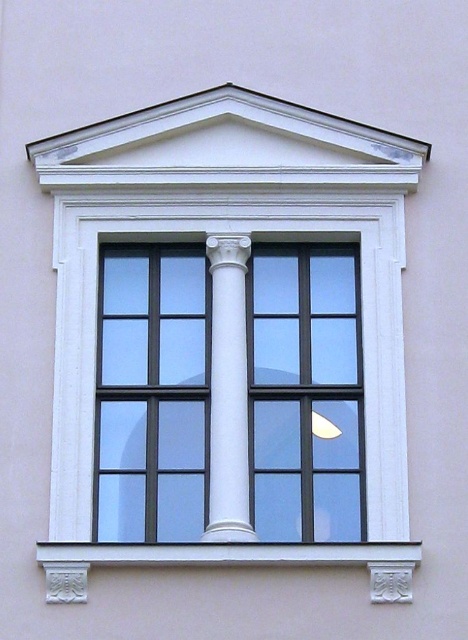
You are standing in front of the window and want to place a small potted plant on the white stone window sill at lower center. However, there is a white glossy column at center in the way. Can you place the plant on the sill without moving the column?

The white stone window sill at lower center is below the white glossy column at center, so you can place the plant on the sill as it is positioned under the column and not obstructed by it.

You are an architect designing a new building and want to ensure the clear glass window at center and the white stone window sill at lower center are proportionate. Based on the image, which object should be adjusted to maintain proper proportions if you want them to be the same size?

The white stone window sill at lower center should be adjusted because the clear glass window at center is currently bigger, so increasing the size of the sill or decreasing the window would make them equal.